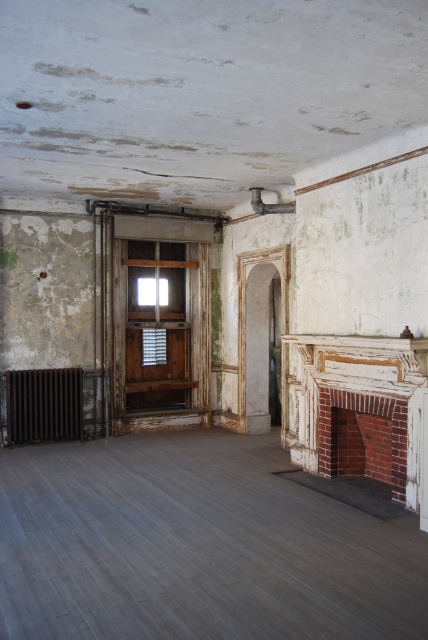
Question: Among these objects, which one is nearest to the camera?

Choices:
 (A) brick fireplace at right
 (B) rusty metal radiator at lower left

Answer: (A)

Question: Is brick fireplace at right to the right of rusty metal radiator at lower left from the viewer's perspective?

Choices:
 (A) yes
 (B) no

Answer: (A)

Question: Does brick fireplace at right appear on the right side of rusty metal radiator at lower left?

Choices:
 (A) yes
 (B) no

Answer: (A)

Question: From the image, what is the correct spatial relationship of brick fireplace at right in relation to rusty metal radiator at lower left?

Choices:
 (A) above
 (B) below

Answer: (A)

Question: Which of the following is the closest to the observer?

Choices:
 (A) (74, 426)
 (B) (404, 364)

Answer: (B)